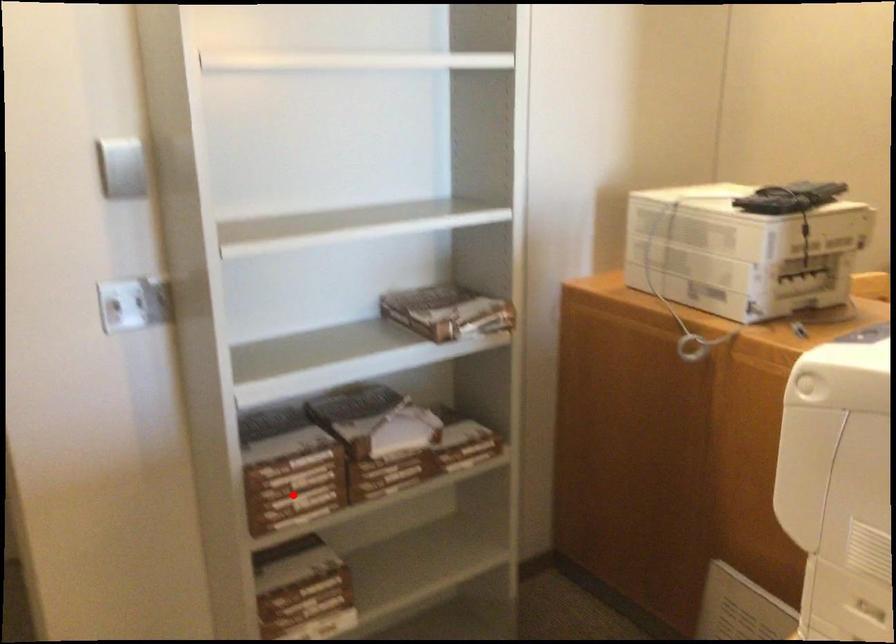
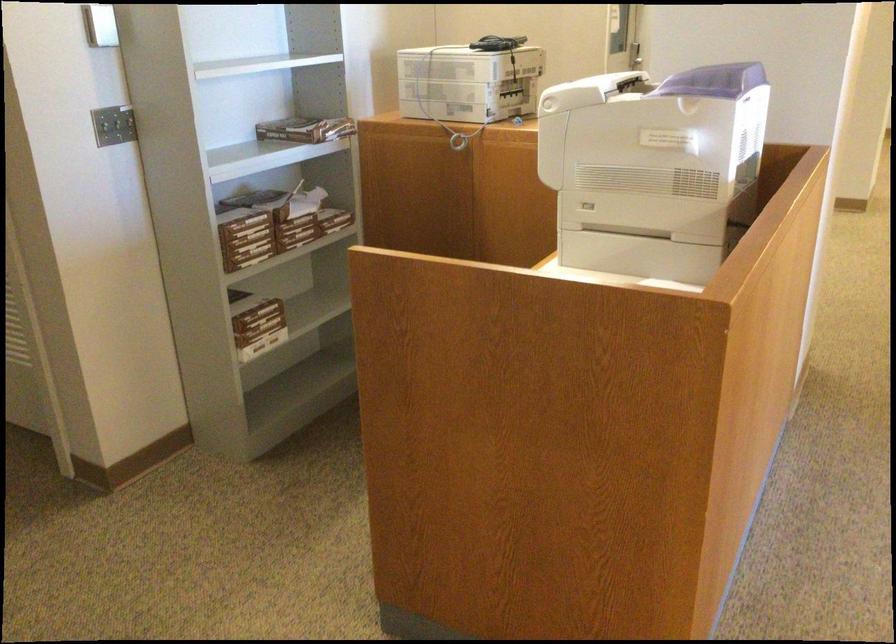
Question: I am providing you with two images of the same scene from different viewpoints. A red point is marked on the first image. Is the red point's position out of view in image 2?

Choices:
 (A) Yes
 (B) No

Answer: (B)